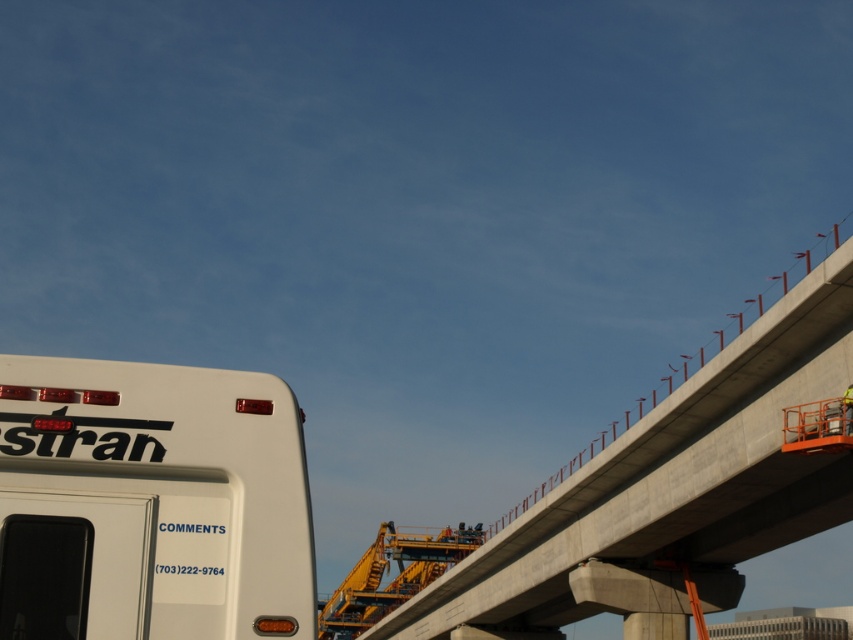
You are a delivery driver who needs to navigate through the construction site shown in the image. You see a white matte bus at lower left and concrete at upper right. Which object is positioned higher from the ground?

The white matte bus at lower left is located above concrete at upper right, so the white matte bus at lower left is positioned higher from the ground.

You are a construction worker standing on the white matte bus at lower left and need to reach the concrete at upper right. Which direction should you move to get there?

You should move to the right because the white matte bus at lower left is to the left of the concrete at upper right.

You are a construction worker standing at point (541, 524). You need to move to point (61, 387). Which direction should you move relative to your current position?

You should move forward because point (61, 387) is in front of point (541, 524).